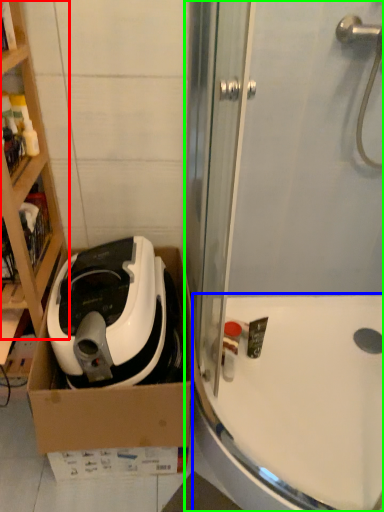
Question: Estimate the real-world distances between objects in this image. Which object is farther from cabinetry (highlighted by a red box), bath (highlighted by a blue box) or shower door (highlighted by a green box)?

Choices:
 (A) bath
 (B) shower door

Answer: (A)